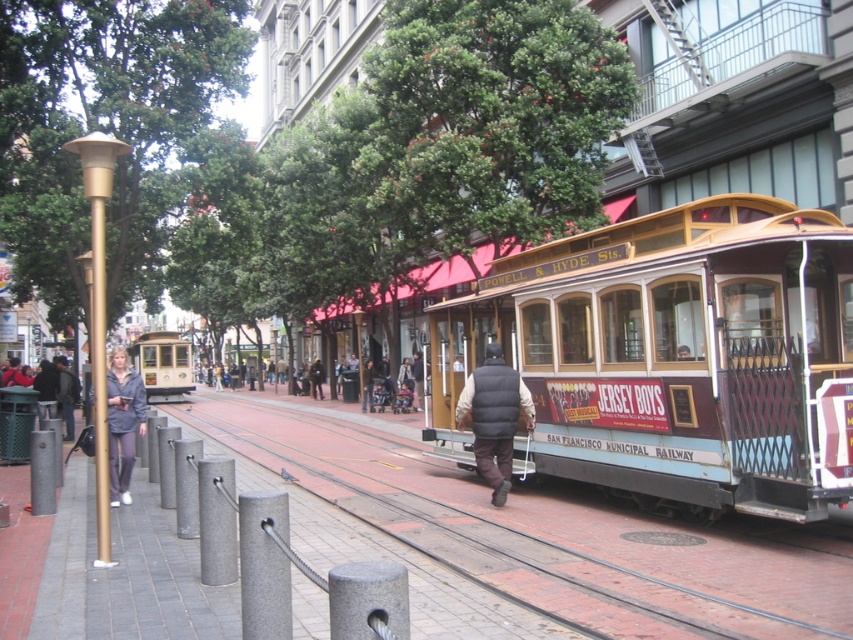
Between black puffy vest at center and matte gold cable car at center, which one has more height?

With more height is matte gold cable car at center.

Can you confirm if black puffy vest at center is thinner than matte gold cable car at center?

Yes, black puffy vest at center is thinner than matte gold cable car at center.

Which is behind, point (514, 397) or point (152, 401)?

The point (152, 401) is behind.

The image size is (853, 640). What are the coordinates of `black puffy vest at center` in the screenshot? It's located at (494, 417).

Which is more to the right, wooden polished cable car at center or matte gold cable car at center?

wooden polished cable car at center

Does wooden polished cable car at center have a greater height compared to matte gold cable car at center?

No, wooden polished cable car at center is not taller than matte gold cable car at center.

The height and width of the screenshot is (640, 853). What are the coordinates of `wooden polished cable car at center` in the screenshot? It's located at (676, 355).

Is black puffy vest at center behind gray fabric jacket at lower left?

Yes, black puffy vest at center is further from the viewer.

Where is `black puffy vest at center`? The height and width of the screenshot is (640, 853). black puffy vest at center is located at coordinates (494, 417).